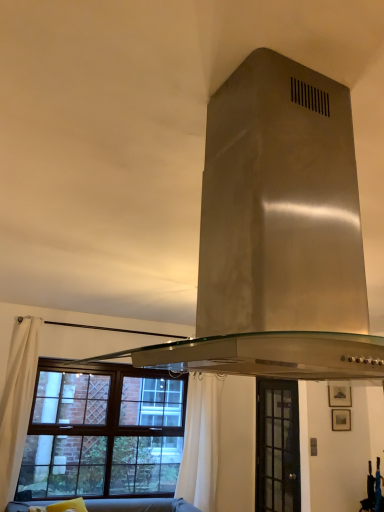
Question: From a real-world perspective, is white fabric curtain at lower center, positioned as the 1th curtain in back-to-front order, physically above clear glass door at center, which is counted as the second window, starting from the left?

Choices:
 (A) yes
 (B) no

Answer: (A)

Question: Is white fabric curtain at lower center, positioned as the 1th curtain in back-to-front order, oriented away from clear glass door at center, which is counted as the second window, starting from the left?

Choices:
 (A) no
 (B) yes

Answer: (A)

Question: Is white fabric curtain at lower center, arranged as the second curtain when viewed from the front, located outside clear glass door at center, which is counted as the second window, starting from the left?

Choices:
 (A) yes
 (B) no

Answer: (A)

Question: Is white fabric curtain at lower center, arranged as the second curtain when viewed from the front, at the right side of clear glass door at center, which ranks as the 1th window in right-to-left order?

Choices:
 (A) no
 (B) yes

Answer: (A)

Question: Can you confirm if white fabric curtain at lower center, which is the 2th curtain in left-to-right order, is wider than clear glass door at center, which ranks as the 1th window in right-to-left order?

Choices:
 (A) yes
 (B) no

Answer: (A)

Question: From the image's perspective, is white fabric curtain at lower center, which is the 2th curtain in left-to-right order, on top of clear glass door at center, which ranks as the 1th window in right-to-left order?

Choices:
 (A) yes
 (B) no

Answer: (A)

Question: Considering the relative sizes of soft gray fabric couch at lower center and white fabric curtain at left, marked as the 1th curtain in a front-to-back arrangement, in the image provided, is soft gray fabric couch at lower center bigger than white fabric curtain at left, marked as the 1th curtain in a front-to-back arrangement,?

Choices:
 (A) yes
 (B) no

Answer: (B)

Question: Can you confirm if soft gray fabric couch at lower center is taller than white fabric curtain at left, marked as the 1th curtain in a front-to-back arrangement?

Choices:
 (A) no
 (B) yes

Answer: (A)

Question: Could you tell me if soft gray fabric couch at lower center is turned towards white fabric curtain at left, which is the first curtain in left-to-right order?

Choices:
 (A) no
 (B) yes

Answer: (A)

Question: Is soft gray fabric couch at lower center next to white fabric curtain at left, marked as the 1th curtain in a front-to-back arrangement?

Choices:
 (A) no
 (B) yes

Answer: (A)

Question: Is soft gray fabric couch at lower center at the left side of white fabric curtain at left, which is the first curtain in left-to-right order?

Choices:
 (A) yes
 (B) no

Answer: (B)

Question: Can we say soft gray fabric couch at lower center lies outside white fabric curtain at left, marked as the 1th curtain in a front-to-back arrangement?

Choices:
 (A) no
 (B) yes

Answer: (B)

Question: From the image's perspective, is soft gray fabric couch at lower center below clear glass door at center, which is counted as the second window, starting from the left?

Choices:
 (A) no
 (B) yes

Answer: (B)